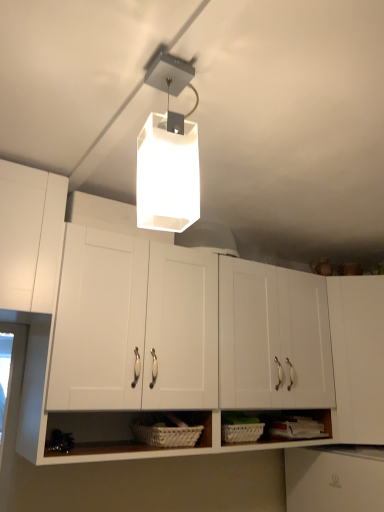
Question: Is white matte rectangular light fixture at upper center to the left or to the right of white matte cabinet at center, placed as the 1th cabinetry when sorted from left to right, in the image?

Choices:
 (A) right
 (B) left

Answer: (B)

Question: Is white matte rectangular light fixture at upper center situated inside white matte cabinet at center, placed as the 1th cabinetry when sorted from left to right, or outside?

Choices:
 (A) inside
 (B) outside

Answer: (B)

Question: Which object is the farthest from the white matte cabinet at right, positioned as the 2th cabinetry in left-to-right order?

Choices:
 (A) white matte cabinet at center, the second cabinetry viewed from the right
 (B) white woven basket at lower center
 (C) white matte rectangular light fixture at upper center

Answer: (C)

Question: Considering the real-world distances, which object is closest to the white matte rectangular light fixture at upper center?

Choices:
 (A) white matte cabinet at right, marked as the 1th cabinetry in a right-to-left arrangement
 (B) white matte cabinet at center, placed as the 1th cabinetry when sorted from left to right
 (C) white woven basket at lower center

Answer: (B)